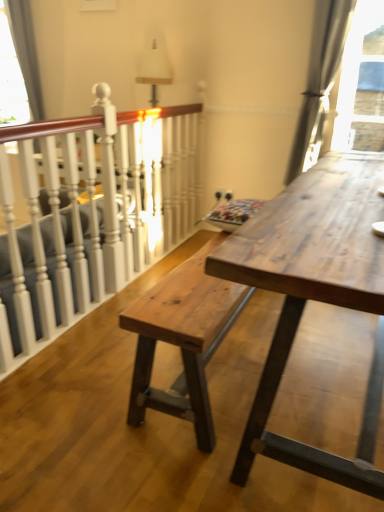
Question: Should I look upward or downward to see satin gray curtain at upper right?

Choices:
 (A) up
 (B) down

Answer: (A)

Question: Is natural wood table at center to the right of satin gray curtain at upper right from the viewer's perspective?

Choices:
 (A) no
 (B) yes

Answer: (A)

Question: Is natural wood table at center positioned beyond the bounds of satin gray curtain at upper right?

Choices:
 (A) no
 (B) yes

Answer: (B)

Question: From a real-world perspective, does natural wood table at center sit lower than satin gray curtain at upper right?

Choices:
 (A) yes
 (B) no

Answer: (A)

Question: Is natural wood table at center oriented towards satin gray curtain at upper right?

Choices:
 (A) yes
 (B) no

Answer: (B)

Question: Does natural wood table at center have a lesser width compared to satin gray curtain at upper right?

Choices:
 (A) yes
 (B) no

Answer: (B)

Question: Does natural wood table at center have a greater width compared to satin gray curtain at upper right?

Choices:
 (A) no
 (B) yes

Answer: (B)

Question: From a real-world perspective, is white painted wood at left beneath natural wood bench at center?

Choices:
 (A) no
 (B) yes

Answer: (A)

Question: Is natural wood bench at center at the back of white painted wood at left?

Choices:
 (A) yes
 (B) no

Answer: (A)

Question: Can you confirm if white painted wood at left is wider than natural wood bench at center?

Choices:
 (A) no
 (B) yes

Answer: (A)

Question: Can you confirm if white painted wood at left is taller than natural wood bench at center?

Choices:
 (A) no
 (B) yes

Answer: (B)

Question: Is white painted wood at left thinner than natural wood bench at center?

Choices:
 (A) yes
 (B) no

Answer: (A)

Question: Is white painted wood at left shorter than natural wood bench at center?

Choices:
 (A) no
 (B) yes

Answer: (A)

Question: From the image's perspective, does natural wood table at center appear lower than white painted wood at left?

Choices:
 (A) yes
 (B) no

Answer: (A)